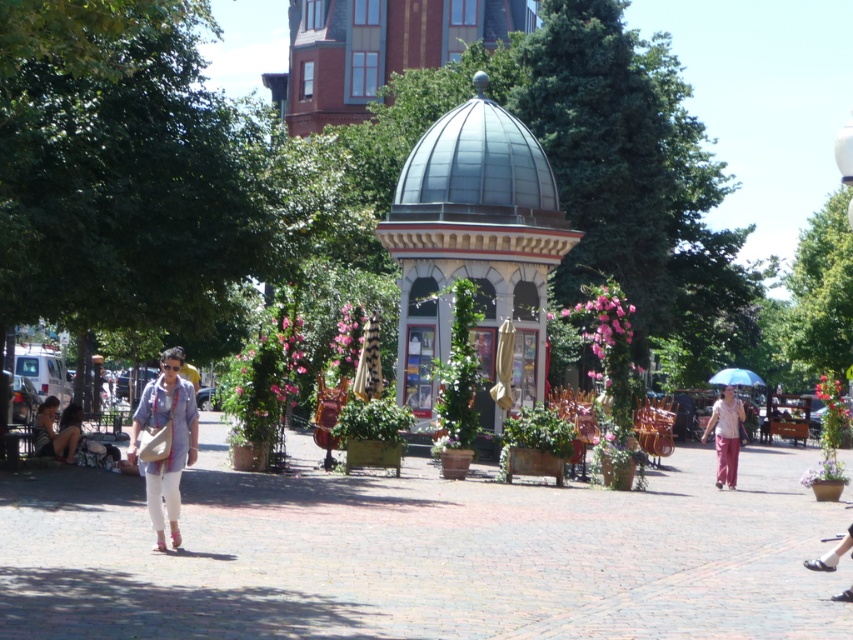
You are a visitor in the plaza and want to take a photo of the transparent blue umbrella at lower right without the green leafy tree at left blocking it. What should you do?

Move to the right side of the green leafy tree at left so that it is no longer in front of the transparent blue umbrella at lower right.

You are standing in the plaza and want to find a spot where you can sit in the shade. Both the green leafy tree at left and the green leafy tree at center provide shade. Which tree would cast a larger shadow area?

The green leafy tree at left is positioned under green leafy tree at center, so the green leafy tree at center would cast a larger shadow area because it is taller and positioned above the other tree.